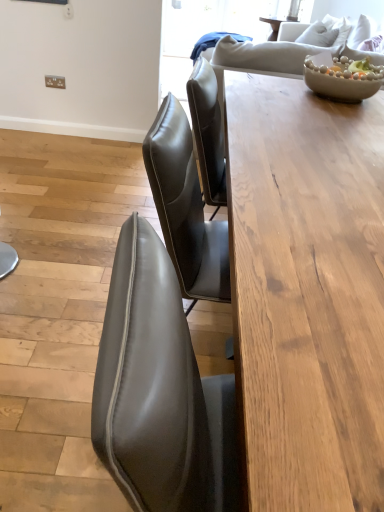
Question: Could you tell me if wooden table at center is facing matte beige bowl at upper right?

Choices:
 (A) yes
 (B) no

Answer: (B)

Question: Is wooden table at center looking in the opposite direction of matte beige bowl at upper right?

Choices:
 (A) yes
 (B) no

Answer: (B)

Question: Would you say wooden table at center is a long distance from matte beige bowl at upper right?

Choices:
 (A) no
 (B) yes

Answer: (A)

Question: Can you confirm if wooden table at center is positioned to the right of matte beige bowl at upper right?

Choices:
 (A) no
 (B) yes

Answer: (A)

Question: From the image's perspective, is wooden table at center on top of matte beige bowl at upper right?

Choices:
 (A) no
 (B) yes

Answer: (A)

Question: Is wooden table at center thinner than matte beige bowl at upper right?

Choices:
 (A) no
 (B) yes

Answer: (A)

Question: From the image's perspective, would you say matte beige bowl at upper right is positioned over wooden table at center?

Choices:
 (A) no
 (B) yes

Answer: (B)

Question: From the image's perspective, is matte beige bowl at upper right below wooden table at center?

Choices:
 (A) no
 (B) yes

Answer: (A)

Question: Considering the relative sizes of matte beige bowl at upper right and wooden table at center in the image provided, is matte beige bowl at upper right thinner than wooden table at center?

Choices:
 (A) yes
 (B) no

Answer: (A)

Question: Is matte beige bowl at upper right looking in the opposite direction of wooden table at center?

Choices:
 (A) no
 (B) yes

Answer: (A)

Question: Does matte beige bowl at upper right appear on the left side of wooden table at center?

Choices:
 (A) yes
 (B) no

Answer: (B)

Question: Is the position of matte beige bowl at upper right more distant than that of wooden table at center?

Choices:
 (A) yes
 (B) no

Answer: (A)

Question: Is point (251, 318) closer or farther from the camera than point (349, 89)?

Choices:
 (A) farther
 (B) closer

Answer: (B)